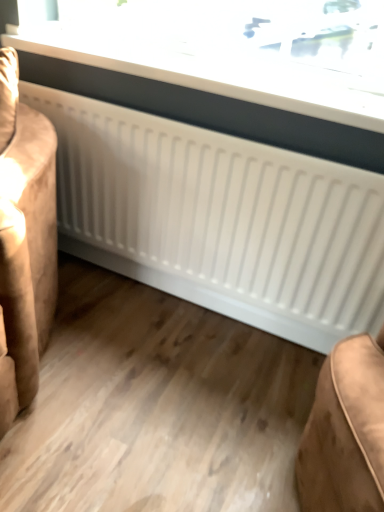
Question: From a real-world perspective, is white matte radiator at lower center physically above white glossy radiator at upper center?

Choices:
 (A) no
 (B) yes

Answer: (A)

Question: Can you confirm if white matte radiator at lower center is taller than white glossy radiator at upper center?

Choices:
 (A) yes
 (B) no

Answer: (A)

Question: Does white matte radiator at lower center have a greater width compared to white glossy radiator at upper center?

Choices:
 (A) no
 (B) yes

Answer: (B)

Question: Does white matte radiator at lower center appear on the right side of white glossy radiator at upper center?

Choices:
 (A) yes
 (B) no

Answer: (B)

Question: Is white matte radiator at lower center further to the viewer compared to white glossy radiator at upper center?

Choices:
 (A) no
 (B) yes

Answer: (A)

Question: Is white matte radiator at lower center oriented away from white glossy radiator at upper center?

Choices:
 (A) no
 (B) yes

Answer: (A)

Question: Are white glossy radiator at upper center and white matte radiator at lower center beside each other?

Choices:
 (A) no
 (B) yes

Answer: (A)

Question: Is white glossy radiator at upper center far away from white matte radiator at lower center?

Choices:
 (A) yes
 (B) no

Answer: (B)

Question: From a real-world perspective, is white glossy radiator at upper center on top of white matte radiator at lower center?

Choices:
 (A) yes
 (B) no

Answer: (A)

Question: Is white glossy radiator at upper center at the left side of white matte radiator at lower center?

Choices:
 (A) no
 (B) yes

Answer: (A)

Question: Is white glossy radiator at upper center located outside white matte radiator at lower center?

Choices:
 (A) no
 (B) yes

Answer: (B)

Question: Is white glossy radiator at upper center wider than white matte radiator at lower center?

Choices:
 (A) yes
 (B) no

Answer: (B)

Question: Considering the positions of white matte radiator at lower center and white glossy radiator at upper center in the image, is white matte radiator at lower center taller or shorter than white glossy radiator at upper center?

Choices:
 (A) tall
 (B) short

Answer: (A)